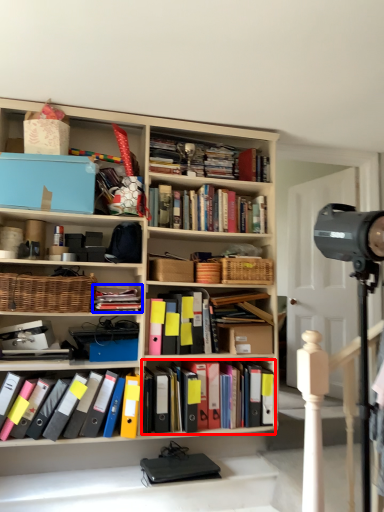
Question: Which object appears closest to the camera in this image, book (highlighted by a red box) or book (highlighted by a blue box)?

Choices:
 (A) book
 (B) book

Answer: (B)